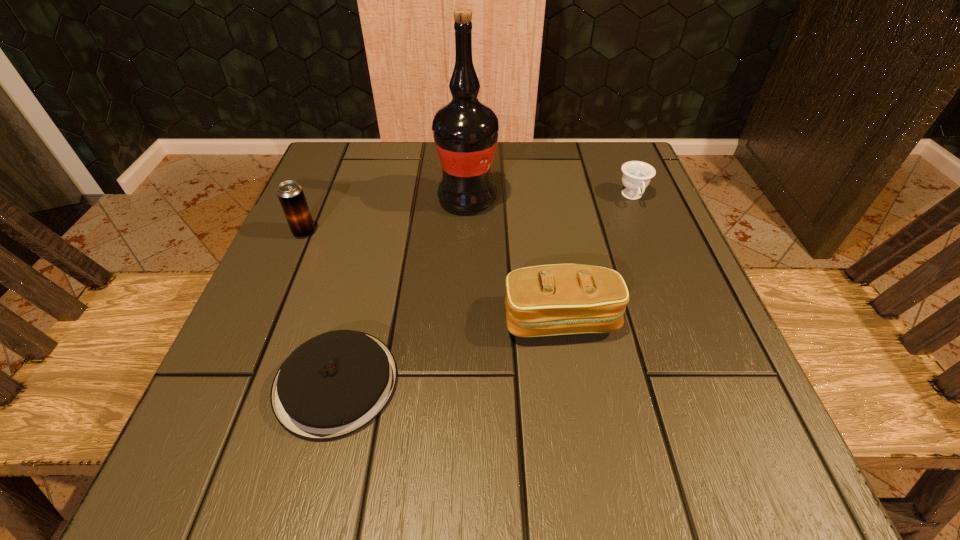
Image resolution: width=960 pixels, height=540 pixels. In the image, there is a desktop. What are the coordinates of `vacant space at the far right corner` in the screenshot? It's located at (632, 144).

What are the coordinates of `free space that is in between the second tallest object and the wine bottle` in the screenshot? It's located at (386, 215).

At what (x,y) coordinates should I click in order to perform the action: click on free space between the beer can and the pancake. Please return your answer as a coordinate pair (x, y). Looking at the image, I should click on click(321, 307).

At what (x,y) coordinates should I click in order to perform the action: click on vacant space in between the leftmost object and the second shortest object. Please return your answer as a coordinate pair (x, y). Looking at the image, I should click on (468, 214).

Where is `vacant area that lies between the wine bottle and the pancake`? The image size is (960, 540). vacant area that lies between the wine bottle and the pancake is located at coordinates (401, 291).

The height and width of the screenshot is (540, 960). I want to click on vacant area that lies between the tallest object and the third nearest object, so click(x=386, y=215).

This screenshot has width=960, height=540. Identify the location of free space between the fourth tallest object and the third nearest object. (468, 214).

Identify the location of free space between the third tallest object and the shortest object. (448, 351).

At what (x,y) coordinates should I click in order to perform the action: click on vacant area that lies between the tallest object and the leftmost object. Please return your answer as a coordinate pair (x, y). Looking at the image, I should click on (386, 215).

The width and height of the screenshot is (960, 540). Identify the location of empty space between the third tallest object and the second tallest object. (433, 276).